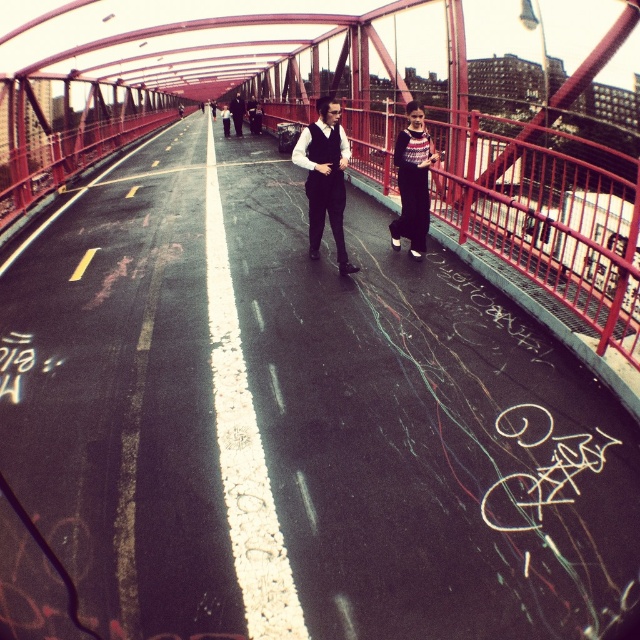
The height and width of the screenshot is (640, 640). What do you see at coordinates (324, 177) in the screenshot?
I see `matte black vest at center` at bounding box center [324, 177].

Does matte black vest at center appear over dark gray suit at center?

Incorrect, matte black vest at center is not positioned above dark gray suit at center.

This screenshot has width=640, height=640. Describe the element at coordinates (324, 177) in the screenshot. I see `matte black vest at center` at that location.

Where is `matte black vest at center`? The width and height of the screenshot is (640, 640). matte black vest at center is located at coordinates (324, 177).

Based on the photo, between knitted sweater at center and dark gray suit at center, which one has less height?

knitted sweater at center is shorter.

Locate an element on the screen. knitted sweater at center is located at coordinates (412, 180).

I want to click on knitted sweater at center, so click(x=412, y=180).

Locate an element on the screen. knitted sweater at center is located at coordinates (412, 180).

Between matte black vest at center and knitted sweater at center, which one has less height?

Standing shorter between the two is knitted sweater at center.

This screenshot has height=640, width=640. Find the location of `matte black vest at center`. matte black vest at center is located at coordinates (324, 177).